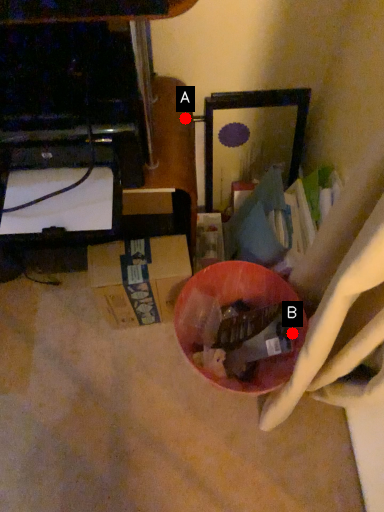
Question: Two points are circled on the image, labeled by A and B beside each circle. Which point is farther from the camera taking this photo?

Choices:
 (A) A is further
 (B) B is further

Answer: (A)